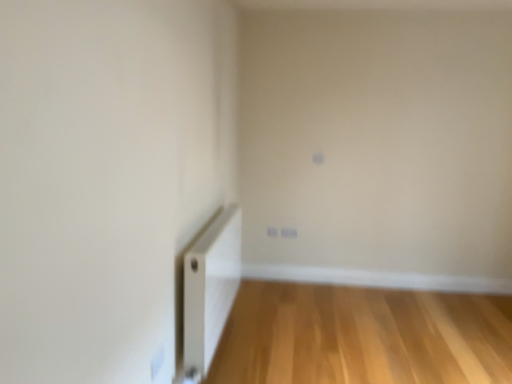
Question: Considering the positions of white plastic radiator at lower left and light wood floor at lower right in the image, is white plastic radiator at lower left bigger or smaller than light wood floor at lower right?

Choices:
 (A) small
 (B) big

Answer: (B)

Question: Is point (214, 311) closer or farther from the camera than point (305, 357)?

Choices:
 (A) closer
 (B) farther

Answer: (A)

Question: From a real-world perspective, is white plastic radiator at lower left above or below light wood floor at lower right?

Choices:
 (A) above
 (B) below

Answer: (A)

Question: Based on their positions, is light wood floor at lower right located to the left or right of white plastic radiator at lower left?

Choices:
 (A) left
 (B) right

Answer: (B)

Question: In terms of width, does light wood floor at lower right look wider or thinner when compared to white plastic radiator at lower left?

Choices:
 (A) wide
 (B) thin

Answer: (A)

Question: From a real-world perspective, relative to white plastic radiator at lower left, is light wood floor at lower right vertically above or below?

Choices:
 (A) above
 (B) below

Answer: (B)

Question: Is light wood floor at lower right inside or outside of white plastic radiator at lower left?

Choices:
 (A) outside
 (B) inside

Answer: (A)